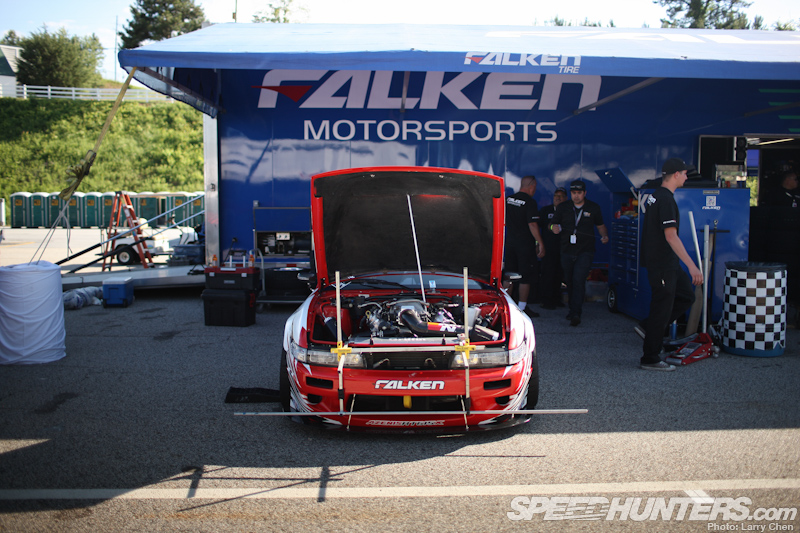
Identify the location of ladder. Image resolution: width=800 pixels, height=533 pixels. (132, 229).